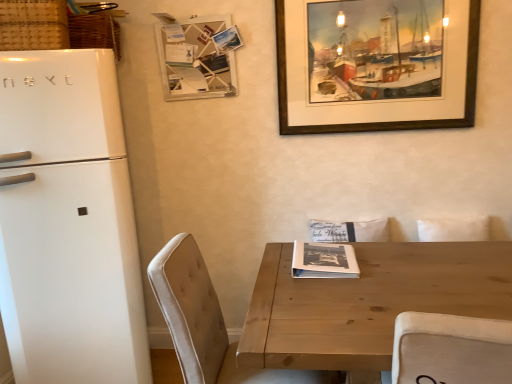
Image resolution: width=512 pixels, height=384 pixels. Describe the element at coordinates (68, 223) in the screenshot. I see `white matte refrigerator at left` at that location.

In order to face beige fabric chair at lower left, should I rotate leftwards or rightwards?

Turn left approximately 1.160 degrees to face it.

I want to click on wooden table at center, so click(368, 302).

How distant is black paper magazine at center from wooden table at center?

black paper magazine at center is 8.38 inches away from wooden table at center.

From the image's perspective, which object appears higher, black paper magazine at center or wooden table at center?

black paper magazine at center.

Is black paper magazine at center positioned far away from wooden table at center?

black paper magazine at center is near wooden table at center, not far away.

Could you tell me if black paper magazine at center is facing wooden table at center?

No, black paper magazine at center is not facing towards wooden table at center.

Can you confirm if wooden table at center is positioned to the left of wooden picture frame at upper right?

No.

From a real-world perspective, is wooden table at center below wooden picture frame at upper right?

Yes, from a real-world perspective, wooden table at center is under wooden picture frame at upper right.

Can you tell me how much wooden table at center and wooden picture frame at upper right differ in facing direction?

0.0215 degrees.

Considering the sizes of wooden table at center and wooden picture frame at upper right in the image, is wooden table at center wider or thinner than wooden picture frame at upper right?

In the image, wooden table at center appears to be wider than wooden picture frame at upper right.

Could you tell me if wooden memo board at upper center is turned towards wooden picture frame at upper right?

No.

From a real-world perspective, is wooden memo board at upper center above or below wooden picture frame at upper right?

From a real-world perspective, wooden memo board at upper center is physically above wooden picture frame at upper right.

Between wooden memo board at upper center and wooden picture frame at upper right, which one has larger width?

With larger width is wooden memo board at upper center.

Is wooden memo board at upper center bigger than wooden picture frame at upper right?

Actually, wooden memo board at upper center might be smaller than wooden picture frame at upper right.

Find the location of a particular element. magazine that is on the right side of beige fabric chair at lower left is located at coordinates (324, 261).

Does black paper magazine at center turn towards beige fabric chair at lower left?

Yes.

Consider the image. Between black paper magazine at center and beige fabric chair at lower left, which one is positioned in front?

beige fabric chair at lower left is more forward.

Looking at the image, does black paper magazine at center seem bigger or smaller compared to beige fabric chair at lower left?

In the image, black paper magazine at center appears to be smaller than beige fabric chair at lower left.

Considering the relative positions of beige fabric chair at lower left and white matte refrigerator at left in the image provided, is beige fabric chair at lower left to the left of white matte refrigerator at left from the viewer's perspective?

In fact, beige fabric chair at lower left is to the right of white matte refrigerator at left.

Is point (185, 234) behind point (69, 289)?

No.

Is beige fabric chair at lower left positioned with its back to white matte refrigerator at left?

beige fabric chair at lower left does not have its back to white matte refrigerator at left.

Based on the photo, is beige fabric chair at lower left located outside white matte refrigerator at left?

Yes, beige fabric chair at lower left is located beyond the bounds of white matte refrigerator at left.

Considering the sizes of objects wooden table at center and beige fabric chair at lower left in the image provided, who is shorter, wooden table at center or beige fabric chair at lower left?

Standing shorter between the two is beige fabric chair at lower left.

Between point (267, 290) and point (191, 267), which one is positioned behind?

The point (191, 267) is farther from the camera.

Is beige fabric chair at lower left at the back of wooden table at center?

wooden table at center is not turned away from beige fabric chair at lower left.

Does wooden table at center appear on the right side of beige fabric chair at lower left?

Yes, wooden table at center is to the right of beige fabric chair at lower left.

In the scene shown: Is black paper magazine at center wider or thinner than white matte refrigerator at left?

In the image, black paper magazine at center appears to be more narrow than white matte refrigerator at left.

From the image's perspective, is black paper magazine at center positioned above or below white matte refrigerator at left?

Clearly, from the image's perspective, black paper magazine at center is below white matte refrigerator at left.

In the image, is black paper magazine at center on the left side or the right side of white matte refrigerator at left?

black paper magazine at center is to the right of white matte refrigerator at left.

Considering the sizes of black paper magazine at center and white matte refrigerator at left in the image, is black paper magazine at center taller or shorter than white matte refrigerator at left?

Clearly, black paper magazine at center is shorter compared to white matte refrigerator at left.

Where is `table that is under the black paper magazine at center (from a real-world perspective)`? Image resolution: width=512 pixels, height=384 pixels. table that is under the black paper magazine at center (from a real-world perspective) is located at coordinates (368, 302).

The image size is (512, 384). There is a wooden table at center. Find the location of `picture frame above it (from a real-world perspective)`. picture frame above it (from a real-world perspective) is located at coordinates (380, 122).

Which object lies further to the anchor point white matte refrigerator at left, wooden memo board at upper center or wooden picture frame at upper right?

wooden picture frame at upper right is further to white matte refrigerator at left.

Considering their positions, is wooden table at center positioned closer to beige fabric chair at lower left than black paper magazine at center?

The object closer to beige fabric chair at lower left is wooden table at center.

Which object lies further to the anchor point wooden memo board at upper center, beige fabric chair at lower left or wooden table at center?

wooden table at center lies further to wooden memo board at upper center than the other object.

Which object lies nearer to the anchor point wooden picture frame at upper right, wooden memo board at upper center or white matte refrigerator at left?

wooden memo board at upper center lies closer to wooden picture frame at upper right than the other object.

Estimate the real-world distances between objects in this image. Which object is closer to wooden memo board at upper center, wooden picture frame at upper right or beige fabric chair at lower left?

wooden picture frame at upper right lies closer to wooden memo board at upper center than the other object.

Looking at the image, which one is located closer to black paper magazine at center, wooden memo board at upper center or wooden table at center?

Answer: Based on the image, wooden table at center appears to be nearer to black paper magazine at center.

Based on their spatial positions, is white matte refrigerator at left or wooden memo board at upper center closer to beige fabric chair at lower left?

white matte refrigerator at left is closer to beige fabric chair at lower left.

In the scene shown: Based on their spatial positions, is wooden memo board at upper center or beige fabric chair at lower left further from wooden picture frame at upper right?

Among the two, beige fabric chair at lower left is located further to wooden picture frame at upper right.

The image size is (512, 384). In order to click on chair located between white matte refrigerator at left and wooden table at center in the left-right direction in this screenshot , I will do `click(207, 322)`.

The width and height of the screenshot is (512, 384). In order to click on magazine between beige fabric chair at lower left and wooden table at center in this screenshot , I will do `click(324, 261)`.

Locate an element on the screen. The height and width of the screenshot is (384, 512). chair between white matte refrigerator at left and black paper magazine at center is located at coordinates (207, 322).

The image size is (512, 384). I want to click on bulletin board located between white matte refrigerator at left and wooden picture frame at upper right in the left-right direction, so click(x=196, y=59).